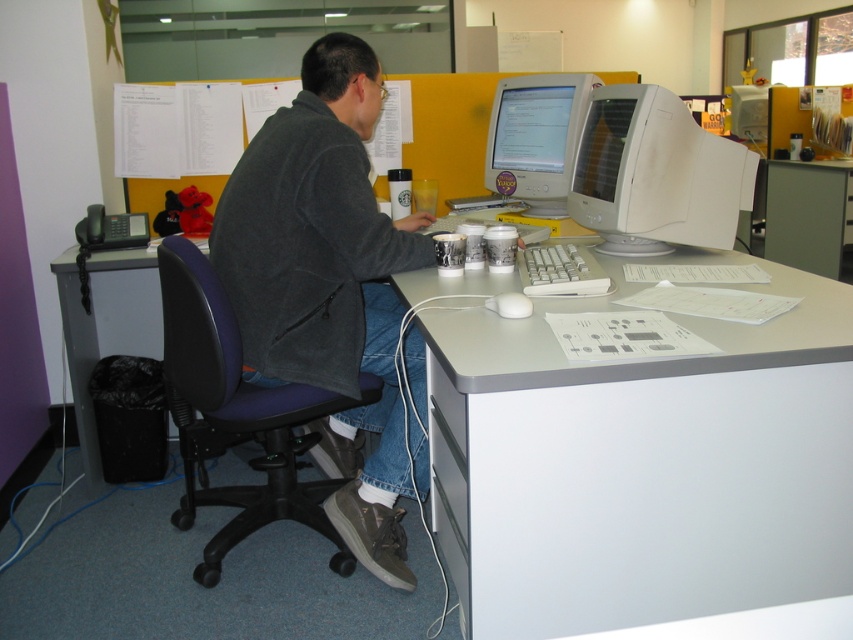
Can you confirm if dark gray jacket at center is positioned below black leather swivel chair at left?

Incorrect, dark gray jacket at center is not positioned below black leather swivel chair at left.

Can you confirm if dark gray jacket at center is taller than black leather swivel chair at left?

Correct, dark gray jacket at center is much taller as black leather swivel chair at left.

The height and width of the screenshot is (640, 853). Find the location of `dark gray jacket at center`. dark gray jacket at center is located at coordinates (328, 284).

The height and width of the screenshot is (640, 853). Find the location of `white glossy monitor at upper center`. white glossy monitor at upper center is located at coordinates (537, 138).

Can you confirm if white glossy monitor at upper center is positioned above matte white monitor at upper center?

Actually, white glossy monitor at upper center is below matte white monitor at upper center.

Is point (534, 182) positioned behind point (550, 97)?

Yes, it is behind point (550, 97).

Image resolution: width=853 pixels, height=640 pixels. What are the coordinates of `white glossy monitor at upper center` in the screenshot? It's located at (537, 138).

Is white plastic computer at center closer to camera compared to black leather swivel chair at left?

Yes, white plastic computer at center is in front of black leather swivel chair at left.

Between white plastic computer at center and black leather swivel chair at left, which one has more height?

Standing taller between the two is black leather swivel chair at left.

What do you see at coordinates (640, 464) in the screenshot? I see `white plastic computer at center` at bounding box center [640, 464].

This screenshot has width=853, height=640. I want to click on white plastic computer at center, so click(640, 464).